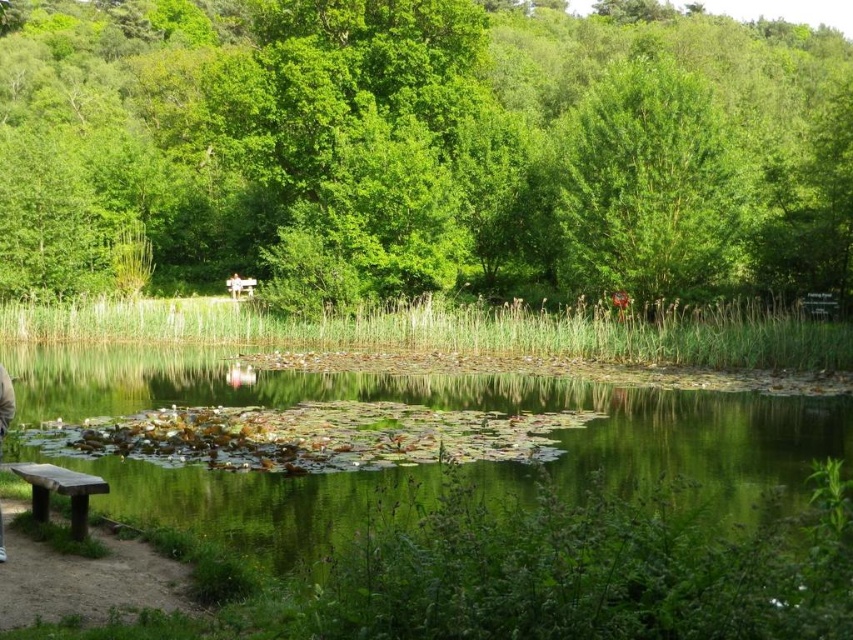
Question: Can you confirm if green leafy tree at center is positioned to the right of green leafy water at lower center?

Choices:
 (A) no
 (B) yes

Answer: (B)

Question: Which object is the closest to the brown dirt path at lower left?

Choices:
 (A) green leafy tree at upper right
 (B) green leafy water at lower center
 (C) wooden bench at lower left

Answer: (C)

Question: Estimate the real-world distances between objects in this image. Which object is closer to the light beige fabric jacket at lower left?

Choices:
 (A) green leafy tree at upper right
 (B) wooden bench at lower left
 (C) green leafy tree at center

Answer: (B)

Question: Which object is positioned closest to the light beige fabric jacket at lower left?

Choices:
 (A) green leafy tree at center
 (B) green leafy tree at upper right

Answer: (B)

Question: Is green leafy tree at center to the left of light beige fabric jacket at lower left from the viewer's perspective?

Choices:
 (A) no
 (B) yes

Answer: (A)

Question: Does green leafy water at lower center lie behind brown dirt path at lower left?

Choices:
 (A) yes
 (B) no

Answer: (B)